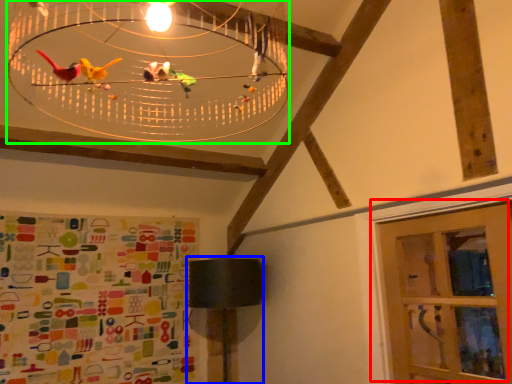
Question: Which object is the closest to the door (highlighted by a red box)? Choose among these: table lamp (highlighted by a blue box) or chandelier (highlighted by a green box).

Choices:
 (A) table lamp
 (B) chandelier

Answer: (A)